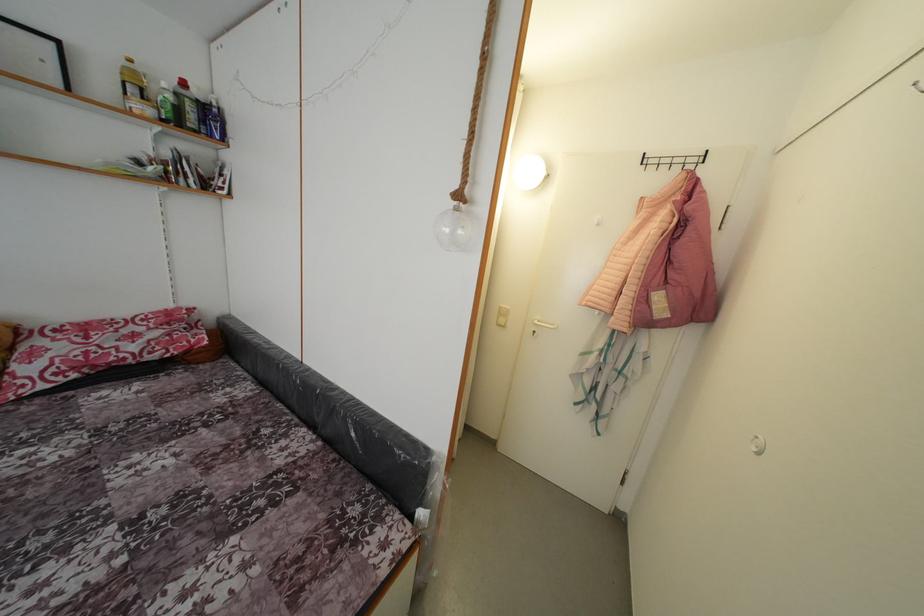
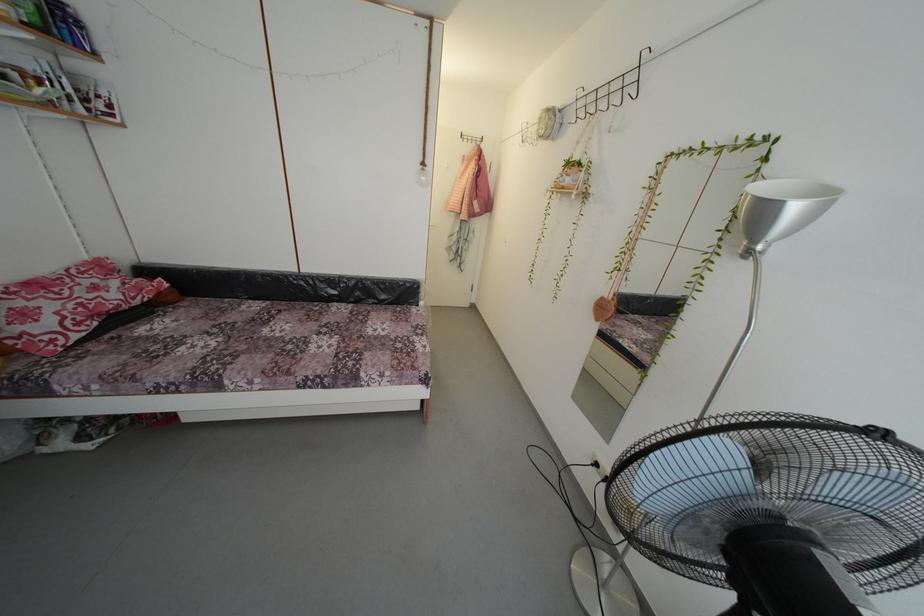
Find the pixel in the second image that matches point (464, 201) in the first image.

(429, 169)